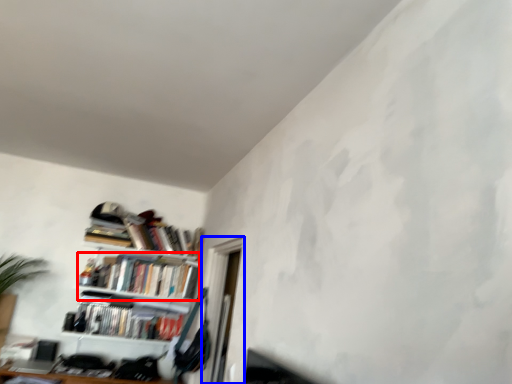
Question: Which of the following is the closest to the observer, book (highlighted by a red box) or window (highlighted by a blue box)?

Choices:
 (A) book
 (B) window

Answer: (B)